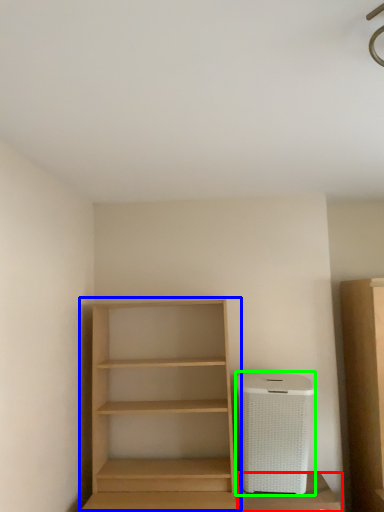
Question: Estimate the real-world distances between objects in this image. Which object is farther from cabinetry (highlighted by a red box), shelf (highlighted by a blue box) or appliance (highlighted by a green box)?

Choices:
 (A) shelf
 (B) appliance

Answer: (A)